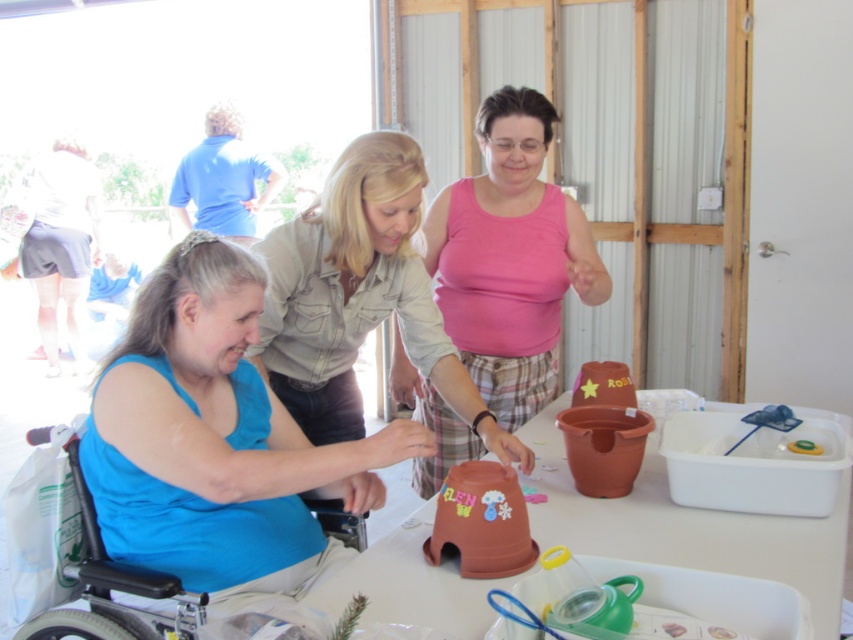
Question: Which object appears farthest from the camera in this image?

Choices:
 (A) terracotta clay pot at center
 (B) blue fabric shirt at center
 (C) pink matte tank top at center
 (D) blue fabric wheelchair at lower left

Answer: (C)

Question: Can you confirm if matte brown pot at center is smaller than terracotta clay pot at center?

Choices:
 (A) no
 (B) yes

Answer: (B)

Question: Is pink matte tank top at center smaller than terracotta clay pot at center?

Choices:
 (A) no
 (B) yes

Answer: (B)

Question: Can you confirm if blue fabric shirt at center is positioned below blue fabric wheelchair at lower left?

Choices:
 (A) yes
 (B) no

Answer: (B)

Question: Among these points, which one is nearest to the camera?

Choices:
 (A) (456, 250)
 (B) (666, 552)

Answer: (B)

Question: Which object appears closest to the camera in this image?

Choices:
 (A) blue fabric shirt at center
 (B) terracotta clay pot at center
 (C) pink matte tank top at center

Answer: (B)